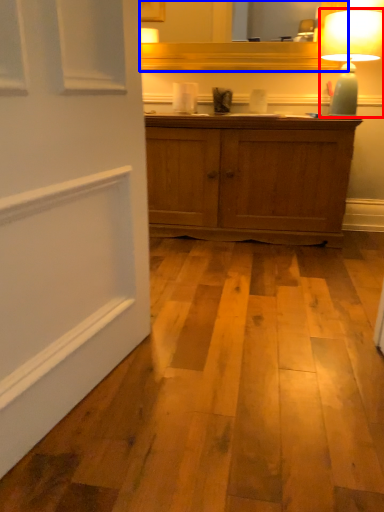
Question: Which of the following is the farthest to the observer, table lamp (highlighted by a red box) or mirror (highlighted by a blue box)?

Choices:
 (A) table lamp
 (B) mirror

Answer: (B)